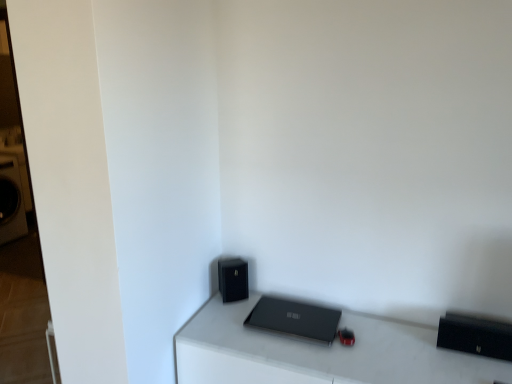
Where is `black matte speaker at lower center`? black matte speaker at lower center is located at coordinates (233, 279).

Image resolution: width=512 pixels, height=384 pixels. I want to click on black matte speaker at lower center, so click(233, 279).

Based on the photo, is matte black laptop at center smaller than matte black laptop at center?

Indeed, matte black laptop at center has a smaller size compared to matte black laptop at center.

You are a GUI agent. You are given a task and a screenshot of the screen. Output one action in this format:
    pyautogui.click(x=<x>, y=<y>)
    Task: Click on the furniture on the right of matte black laptop at center
    
    Given the screenshot: What is the action you would take?
    pyautogui.click(x=319, y=353)

Is matte black laptop at center facing away from matte black laptop at center?

No, matte black laptop at center is not facing the opposite direction of matte black laptop at center.

Is point (263, 299) closer to camera compared to point (187, 363)?

No.

From the image's perspective, is matte black laptop at center on top of black matte speaker at lower center?

No, from the image's perspective, matte black laptop at center is not above black matte speaker at lower center.

Is black matte speaker at lower center completely or partially inside matte black laptop at center?

That's incorrect, black matte speaker at lower center is not inside matte black laptop at center.

Is matte black laptop at center to the left or to the right of black matte speaker at lower center in the image?

Based on their positions, matte black laptop at center is located to the right of black matte speaker at lower center.

Which object is closer to the camera taking this photo, matte black laptop at center or black matte speaker at lower center?

matte black laptop at center is in front.

Can you see black matte speaker at lower center touching matte black laptop at center?

No, black matte speaker at lower center is not in contact with matte black laptop at center.

Who is shorter, black matte speaker at lower center or matte black laptop at center?

Standing shorter between the two is matte black laptop at center.

Which of these two, black matte speaker at lower center or matte black laptop at center, is thinner?

black matte speaker at lower center.

In the scene shown: Which object is further away from the camera, matte black laptop at center or black matte speaker at lower center?

black matte speaker at lower center is behind.

From the image's perspective, which one is positioned higher, matte black laptop at center or black matte speaker at lower center?

From the image's view, black matte speaker at lower center is above.

Is matte black laptop at center aimed at black matte speaker at lower center?

No, matte black laptop at center is not facing towards black matte speaker at lower center.

Between black matte speaker at lower center and matte black laptop at center, which one has smaller width?

black matte speaker at lower center is thinner.

Where is `furniture on the right of the black matte speaker at lower center`? furniture on the right of the black matte speaker at lower center is located at coordinates (319, 353).

Considering the positions of objects black matte speaker at lower center and matte black laptop at center in the image provided, who is behind, black matte speaker at lower center or matte black laptop at center?

Positioned behind is black matte speaker at lower center.

Looking at this image, is black matte speaker at lower center taller than matte black laptop at center?

Incorrect, the height of black matte speaker at lower center is not larger of that of matte black laptop at center.

Who is bigger, matte black laptop at center or matte black laptop at center?

Bigger between the two is matte black laptop at center.

From the image's perspective, relative to matte black laptop at center, is matte black laptop at center above or below?

From the image's perspective, matte black laptop at center appears below matte black laptop at center.

In the scene shown: Is matte black laptop at center to the left or to the right of matte black laptop at center in the image?

Clearly, matte black laptop at center is on the right of matte black laptop at center in the image.

Image resolution: width=512 pixels, height=384 pixels. I want to click on laptop that appears above the matte black laptop at center (from a real-world perspective), so click(294, 319).

At what (x,y) coordinates should I click in order to perform the action: click on furniture in front of the matte black laptop at center. Please return your answer as a coordinate pair (x, y). The width and height of the screenshot is (512, 384). Looking at the image, I should click on (319, 353).

At what (x,y) coordinates should I click in order to perform the action: click on furniture lying below the black matte speaker at lower center (from the image's perspective). Please return your answer as a coordinate pair (x, y). The image size is (512, 384). Looking at the image, I should click on (319, 353).

Considering their positions, is matte black laptop at center positioned further to black matte speaker at lower center than matte black laptop at center?

Based on the image, matte black laptop at center appears to be further to black matte speaker at lower center.

Consider the image. When comparing their distances from matte black laptop at center, does matte black laptop at center or black matte speaker at lower center seem further?

black matte speaker at lower center is further to matte black laptop at center.

In the scene shown: Based on their spatial positions, is black matte speaker at lower center or matte black laptop at center further from matte black laptop at center?

Among the two, black matte speaker at lower center is located further to matte black laptop at center.

Based on their spatial positions, is matte black laptop at center or matte black laptop at center further from black matte speaker at lower center?

The object further to black matte speaker at lower center is matte black laptop at center.

Estimate the real-world distances between objects in this image. Which object is closer to matte black laptop at center, matte black laptop at center or black matte speaker at lower center?

matte black laptop at center.

Which object lies nearer to the anchor point matte black laptop at center, black matte speaker at lower center or matte black laptop at center?

Based on the image, matte black laptop at center appears to be nearer to matte black laptop at center.

At what (x,y) coordinates should I click in order to perform the action: click on laptop between matte black laptop at center and black matte speaker at lower center from front to back. Please return your answer as a coordinate pair (x, y). Looking at the image, I should click on (294, 319).